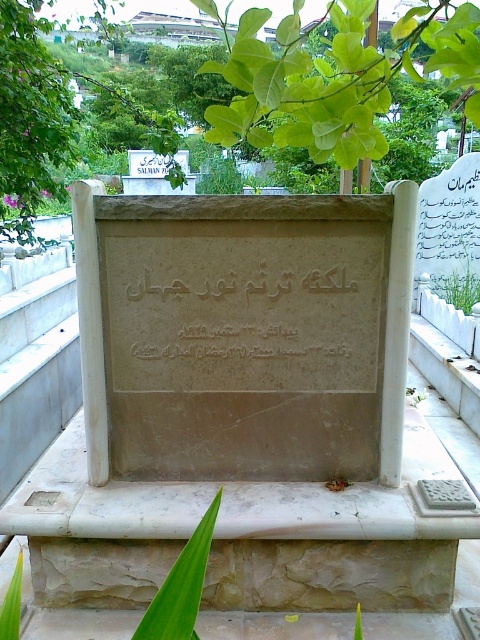
Question: Which of the following is the closest to the observer?

Choices:
 (A) green leafy plant at center
 (B) green leafy tree at upper center
 (C) green leafy plant at upper center
 (D) green leafy plant at lower left

Answer: (A)

Question: Is matte stone inscription at center above green leafy plant at center?

Choices:
 (A) no
 (B) yes

Answer: (B)

Question: Can you confirm if matte stone inscription at center is positioned to the left of green leafy plant at upper center?

Choices:
 (A) yes
 (B) no

Answer: (A)

Question: Which object appears farthest from the camera in this image?

Choices:
 (A) green leafy plant at upper center
 (B) green leafy tree at upper center
 (C) matte stone inscription at center

Answer: (A)

Question: Is matte stone inscription at center smaller than green leafy plant at lower left?

Choices:
 (A) no
 (B) yes

Answer: (A)

Question: Which object is the closest to the green leafy plant at lower left?

Choices:
 (A) green leafy plant at center
 (B) matte stone inscription at center
 (C) green leafy tree at upper center

Answer: (A)